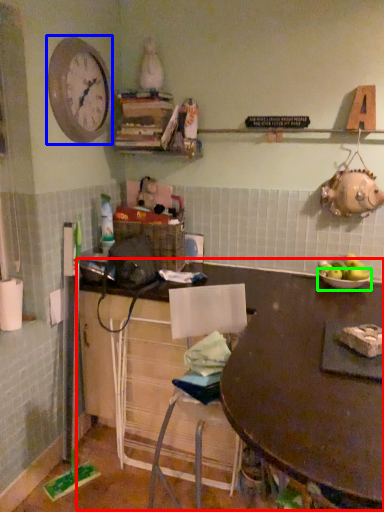
Question: Which is farther away from table (highlighted by a red box)? clock (highlighted by a blue box) or bowl (highlighted by a green box)?

Choices:
 (A) clock
 (B) bowl

Answer: (A)